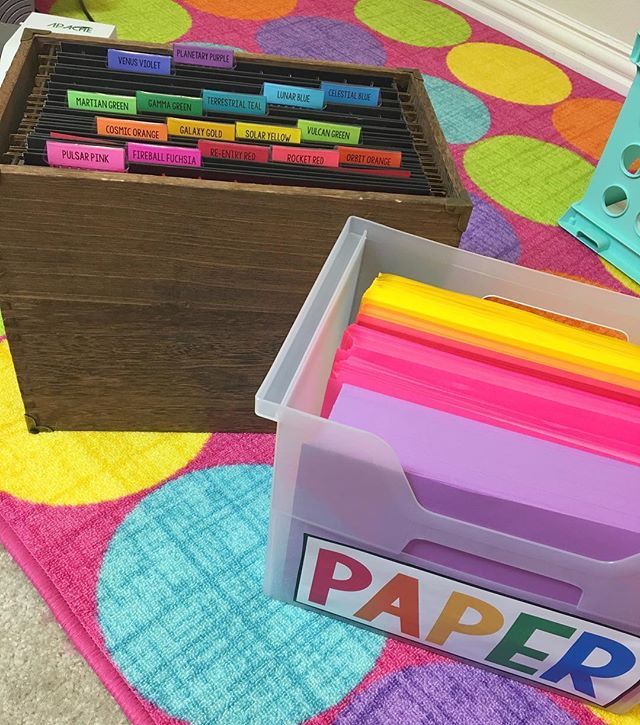
At what (x,y) coordinates should I click in order to perform the action: click on plastic container. Please return your answer as a coordinate pair (x, y). Looking at the image, I should click on (349, 513).